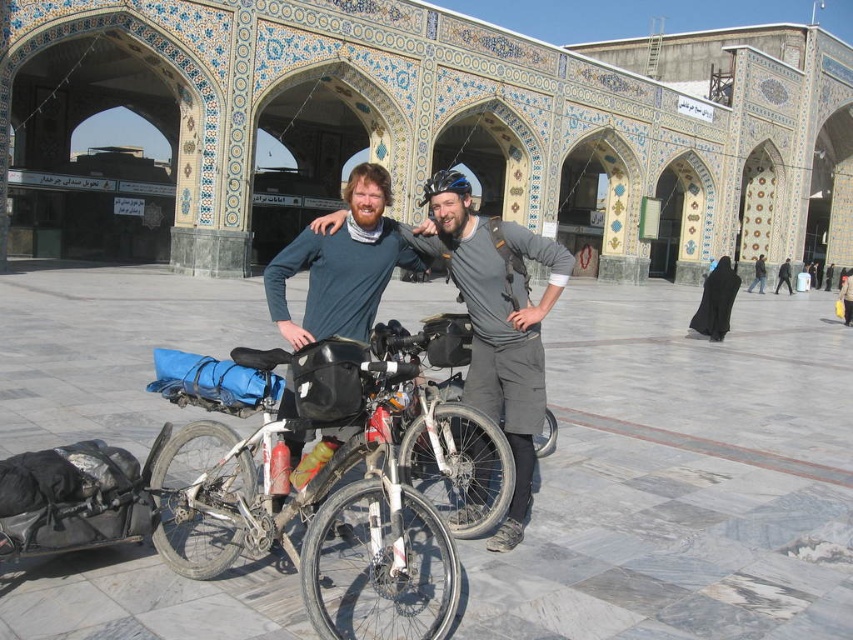
Question: Considering the relative positions of white matte bicycle at center and black fabric headscarf at center in the image provided, where is white matte bicycle at center located with respect to black fabric headscarf at center?

Choices:
 (A) right
 (B) left

Answer: (B)

Question: Among these points, which one is farthest from the camera?

Choices:
 (A) (352, 509)
 (B) (724, 312)

Answer: (B)

Question: Which object is closer to the camera taking this photo?

Choices:
 (A) black fabric headscarf at center
 (B) matte gray shirt at center
 (C) white matte bicycle at center

Answer: (C)

Question: Which of the following is the farthest from the observer?

Choices:
 (A) (334, 579)
 (B) (697, 316)
 (C) (479, 488)

Answer: (B)

Question: Is matte gray shirt at center closer to camera compared to black fabric headscarf at center?

Choices:
 (A) no
 (B) yes

Answer: (B)

Question: Is matte gray shirt at center wider than black fabric headscarf at center?

Choices:
 (A) no
 (B) yes

Answer: (A)